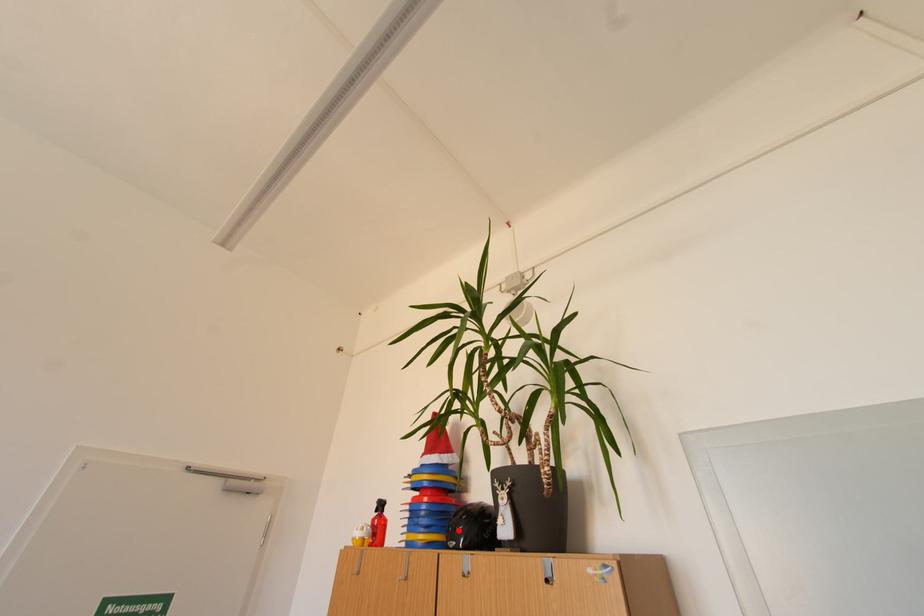
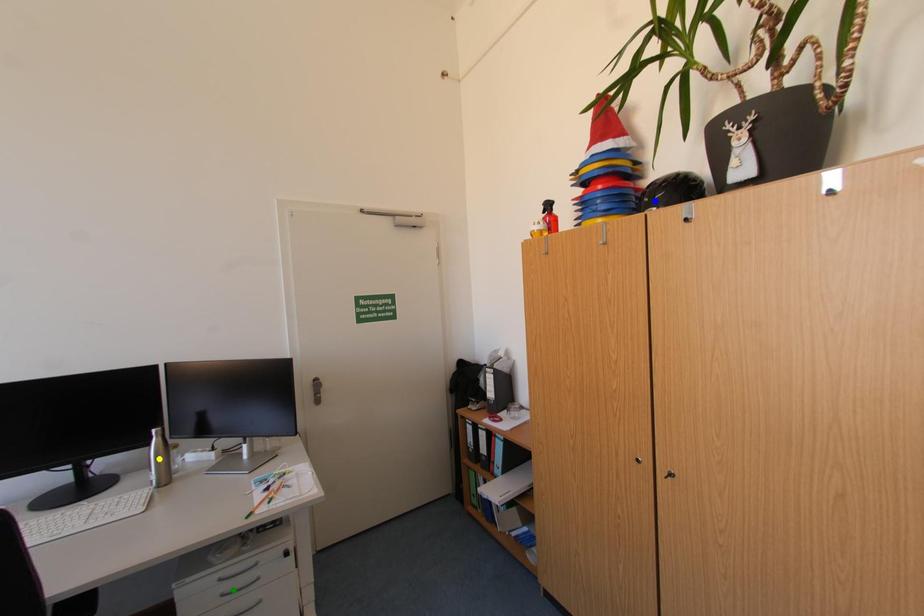
Question: I am providing you with two images of the same scene from different viewpoints. A red point is marked on the first image. You are given multiple points on the second image. Which point in image 2 is actually the same real-world point as the red point in image 1?

Choices:
 (A) blue point
 (B) green point
 (C) yellow point

Answer: (A)